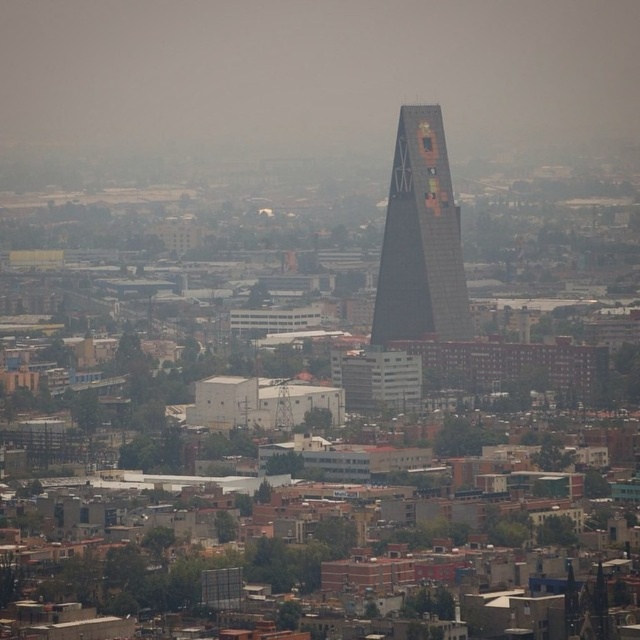
You are a drone operator trying to navigate a delivery drone through the urban area shown in the image. The drone must avoid the transparent fog at center. What coordinates should the drone avoid?

The drone should avoid the coordinates at point (312, 76) where the transparent fog at center is located.

You are a drone operator tasked with flying a drone from the transparent fog at center to the dark glass skyscraper at center. Given that the drone has a maximum flight range of 35 meters, will it be able to reach the skyscraper?

The transparent fog at center is 36.29 meters from the dark glass skyscraper at center. Since the drone can only fly up to 35 meters, it will not be able to reach the skyscraper.

You are a city planner assessing the view from a new observation deck. You notice the transparent fog at center and the dark glass skyscraper at center. Which of these two elements appears bigger in the scene?

The transparent fog at center appears bigger than the dark glass skyscraper at center because it has a larger size compared to it.